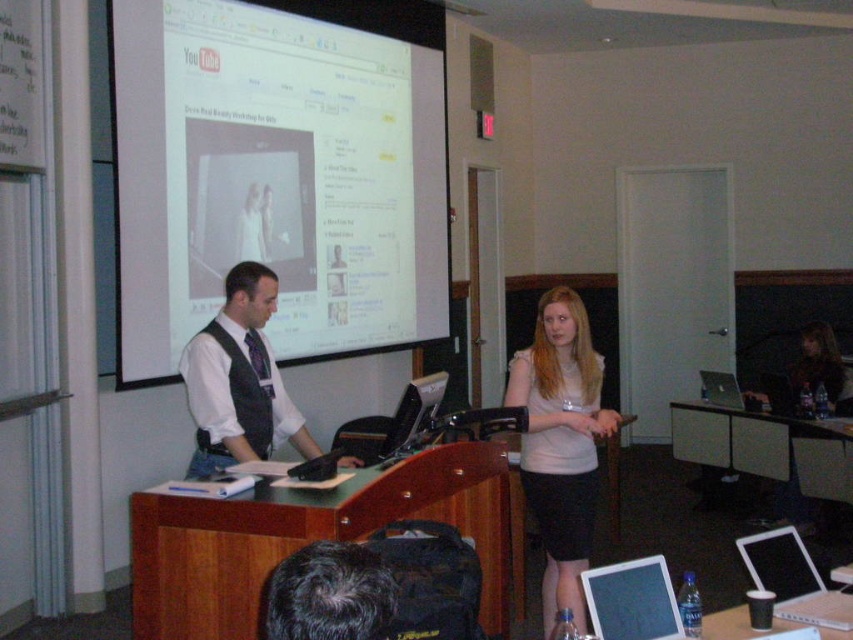
Question: Considering the real-world distances, which object is closest to the matte black vest at center?

Choices:
 (A) white glossy projection screen at upper center
 (B) light pink fabric shirt at center

Answer: (B)

Question: Can you confirm if white glossy projection screen at upper center is positioned to the left of matte black tablet at lower center?

Choices:
 (A) yes
 (B) no

Answer: (A)

Question: Which is nearer to the matte black vest at center?

Choices:
 (A) matte black tablet at lower center
 (B) silver metallic laptop at lower right
 (C) white glossy projection screen at upper center

Answer: (A)

Question: Considering the relative positions of light pink fabric shirt at center and silver metallic laptop at lower right in the image provided, where is light pink fabric shirt at center located with respect to silver metallic laptop at lower right?

Choices:
 (A) above
 (B) below

Answer: (A)

Question: Estimate the real-world distances between objects in this image. Which object is farther from the matte black tablet at lower center?

Choices:
 (A) matte black vest at center
 (B) silver metallic laptop at lower right
 (C) white glossy projection screen at upper center

Answer: (C)

Question: Can you confirm if matte black tablet at lower center is bigger than silver metallic laptop at center?

Choices:
 (A) no
 (B) yes

Answer: (A)